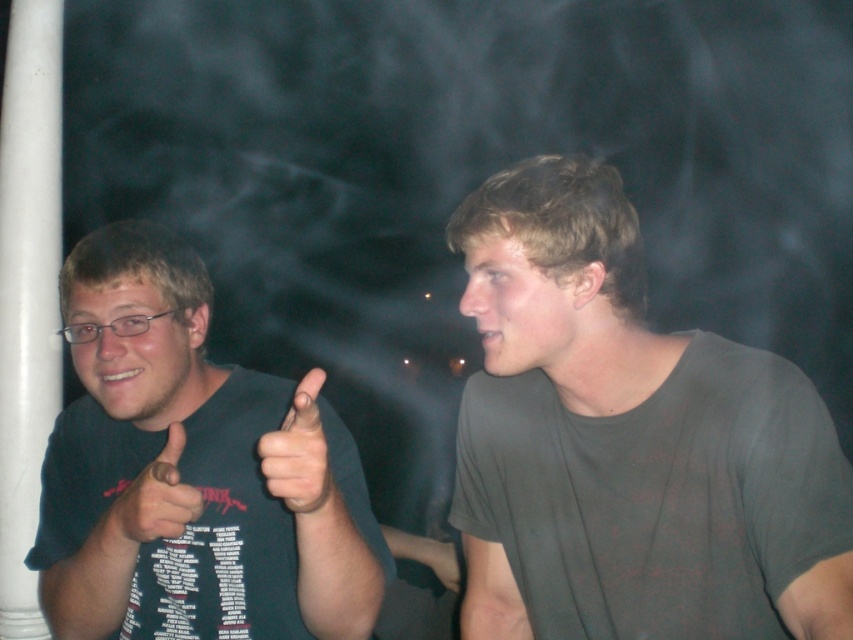
How distant is gray matte t-shirt at center from matte black thumb at left?

gray matte t-shirt at center is 16.23 inches away from matte black thumb at left.

Does gray matte t-shirt at center appear on the right side of matte black thumb at left?

Yes, gray matte t-shirt at center is to the right of matte black thumb at left.

Which is behind, point (643, 602) or point (190, 513)?

Point (643, 602)

I want to click on gray matte t-shirt at center, so click(x=628, y=442).

Is gray matte t-shirt at center shorter than dark blue t-shirt at left?

In fact, gray matte t-shirt at center may be taller than dark blue t-shirt at left.

Does point (514, 182) come closer to viewer compared to point (236, 609)?

Yes, it is in front of point (236, 609).

Where is `gray matte t-shirt at center`? The height and width of the screenshot is (640, 853). gray matte t-shirt at center is located at coordinates (628, 442).

Does dark blue t-shirt at left have a lesser width compared to skinny white hand at center?

Incorrect, dark blue t-shirt at left's width is not less than skinny white hand at center's.

Which is more to the right, dark blue t-shirt at left or skinny white hand at center?

Positioned to the right is skinny white hand at center.

What do you see at coordinates (192, 472) in the screenshot?
I see `dark blue t-shirt at left` at bounding box center [192, 472].

Where is `dark blue t-shirt at left`? This screenshot has width=853, height=640. dark blue t-shirt at left is located at coordinates (192, 472).